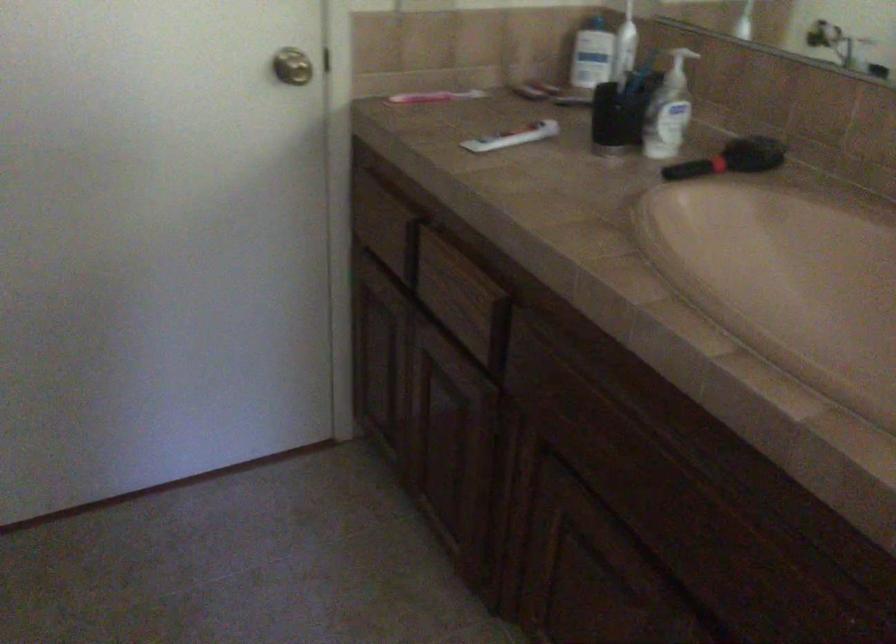
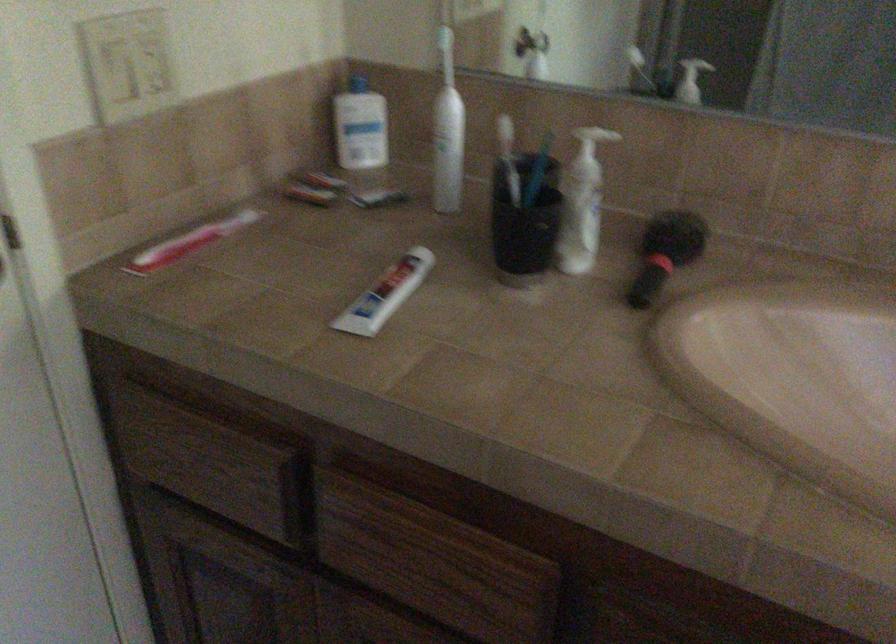
In the second image, find the point that corresponds to [653,118] in the first image.

(579, 225)